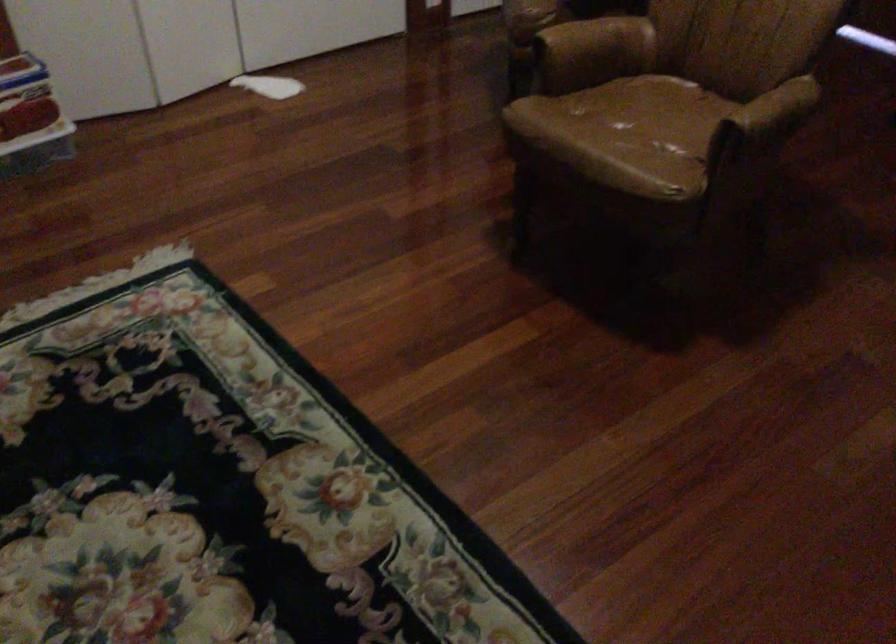
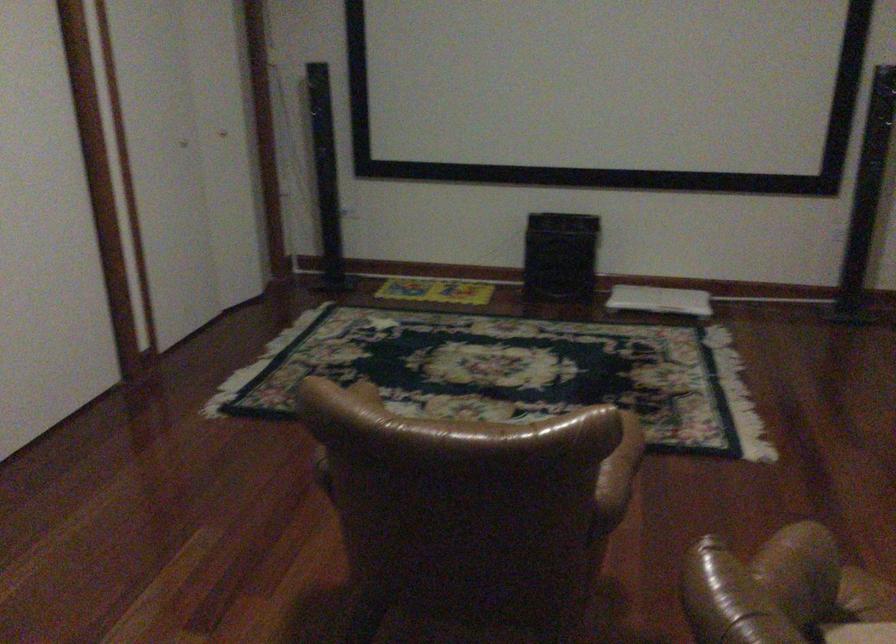
Question: I am providing you with two images of the same scene from different viewpoints. Which of the following objects are not visible in image2?

Choices:
 (A) black speaker box
 (B) brown paper napkin
 (C) brown leather armrest
 (D) brown chair armrest

Answer: (D)